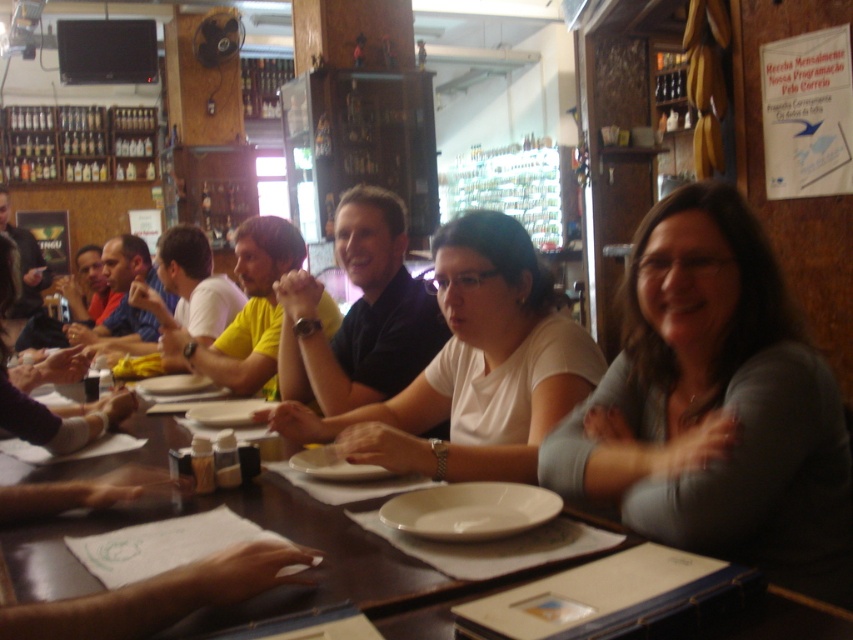
Question: Which object appears closest to the camera in this image?

Choices:
 (A) wooden table at center
 (B) white matte shirt at center
 (C) gray matte shirt at center

Answer: (A)

Question: Observing the image, what is the correct spatial positioning of white matte shirt at center in reference to wooden table at center?

Choices:
 (A) above
 (B) below

Answer: (A)

Question: Which point is closer to the camera?

Choices:
 (A) gray matte shirt at center
 (B) white matte shirt at center

Answer: (A)

Question: Can you confirm if gray matte shirt at center is thinner than wooden table at center?

Choices:
 (A) no
 (B) yes

Answer: (B)

Question: Which point is farther from the camera taking this photo?

Choices:
 (A) (115, 509)
 (B) (457, 262)
 (C) (804, 400)

Answer: (B)

Question: Is gray matte shirt at center behind white matte shirt at center?

Choices:
 (A) no
 (B) yes

Answer: (A)